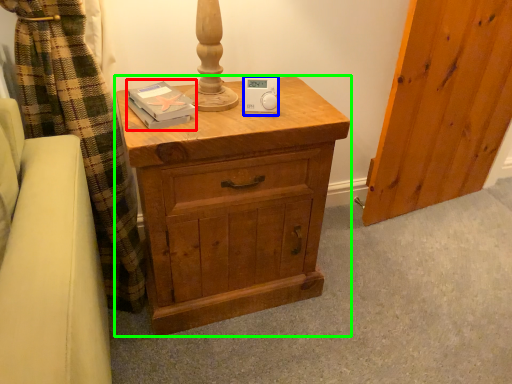
Question: Based on their relative distances, which object is farther from book (highlighted by a red box)? Choose from ipod (highlighted by a blue box) and chest of drawers (highlighted by a green box).

Choices:
 (A) ipod
 (B) chest of drawers

Answer: (B)